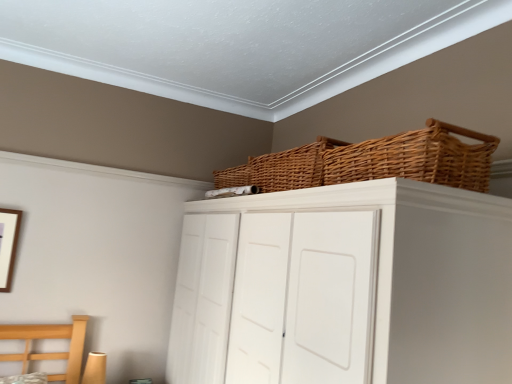
Question: Is white matte cupboard at upper center thinner than woven brown basket at upper center, the 2th basket in the front-to-back sequence?

Choices:
 (A) no
 (B) yes

Answer: (A)

Question: Can you confirm if white matte cupboard at upper center is shorter than woven brown basket at upper center, which ranks as the 1th basket in back-to-front order?

Choices:
 (A) yes
 (B) no

Answer: (B)

Question: Considering the relative sizes of white matte cupboard at upper center and woven brown basket at upper center, which ranks as the 1th basket in back-to-front order, in the image provided, is white matte cupboard at upper center smaller than woven brown basket at upper center, which ranks as the 1th basket in back-to-front order,?

Choices:
 (A) no
 (B) yes

Answer: (A)

Question: Considering the relative positions of white matte cupboard at upper center and woven brown basket at upper center, the 2th basket in the front-to-back sequence, in the image provided, is white matte cupboard at upper center to the left of woven brown basket at upper center, the 2th basket in the front-to-back sequence, from the viewer's perspective?

Choices:
 (A) no
 (B) yes

Answer: (B)

Question: From the image's perspective, is white matte cupboard at upper center located above woven brown basket at upper center, the 2th basket in the front-to-back sequence?

Choices:
 (A) yes
 (B) no

Answer: (B)

Question: Is woven brown basket at upper center, positioned as the 1th basket in front-to-back order, taller or shorter than woven brown basket at upper center, the 2th basket in the front-to-back sequence?

Choices:
 (A) tall
 (B) short

Answer: (B)

Question: Looking at the image, does woven brown basket at upper center, arranged as the second basket when viewed from the back, seem bigger or smaller compared to woven brown basket at upper center, the 2th basket in the front-to-back sequence?

Choices:
 (A) small
 (B) big

Answer: (A)

Question: Is point (442, 183) closer or farther from the camera than point (263, 190)?

Choices:
 (A) closer
 (B) farther

Answer: (A)

Question: From a real-world perspective, is woven brown basket at upper center, arranged as the second basket when viewed from the back, physically located above or below woven brown basket at upper center, which ranks as the 1th basket in back-to-front order?

Choices:
 (A) above
 (B) below

Answer: (B)

Question: In terms of height, does wooden picture frame at left look taller or shorter compared to woven brown basket at upper center, positioned as the 1th basket in front-to-back order?

Choices:
 (A) short
 (B) tall

Answer: (B)

Question: Would you say wooden picture frame at left is to the left or to the right of woven brown basket at upper center, positioned as the 1th basket in front-to-back order, in the picture?

Choices:
 (A) right
 (B) left

Answer: (B)

Question: From the image's perspective, relative to woven brown basket at upper center, arranged as the second basket when viewed from the back, is wooden picture frame at left above or below?

Choices:
 (A) below
 (B) above

Answer: (A)

Question: Relative to woven brown basket at upper center, positioned as the 1th basket in front-to-back order, is wooden picture frame at left in front or behind?

Choices:
 (A) front
 (B) behind

Answer: (B)

Question: Visually, is white matte cupboard at upper center positioned to the left or to the right of wooden picture frame at left?

Choices:
 (A) right
 (B) left

Answer: (A)

Question: Considering the positions of point (322, 370) and point (12, 215), is point (322, 370) closer or farther from the camera than point (12, 215)?

Choices:
 (A) farther
 (B) closer

Answer: (B)